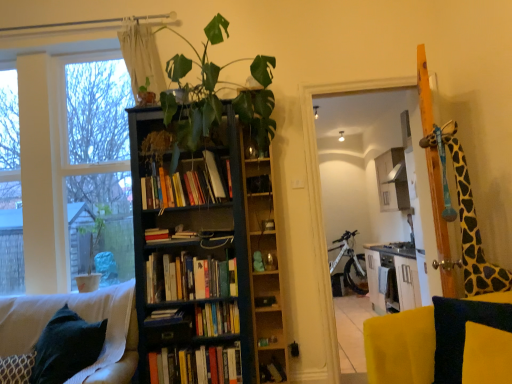
Question: Considering their positions, is velvet dark blue cushion at lower left located in front of or behind white painted wood at left?

Choices:
 (A) front
 (B) behind

Answer: (A)

Question: Is point 13,309 positioned closer to the camera than point 24,69?

Choices:
 (A) closer
 (B) farther

Answer: (A)

Question: Estimate the real-world distances between objects in this image. Which object is farther from the dark blue wood bookcase at center?

Choices:
 (A) yellow wood screen door at upper right
 (B) hardcover books at center, the third book from the bottom
 (C) green matte plant at left, which is the second houseplant in top-to-bottom order
 (D) white matte bicycle at center
 (E) matte white ceiling light at upper center

Answer: (E)

Question: Which object is positioned farthest from the wooden bookshelf at center?

Choices:
 (A) hardcover books at center, the third book from the top
 (B) hardcover book at center, which is counted as the 4th book, starting from the top
 (C) green matte plant at left, marked as the 1th houseplant in a back-to-front arrangement
 (D) hardcover books at center, the 1th book when ordered from bottom to top
 (E) white matte bicycle at center

Answer: (E)